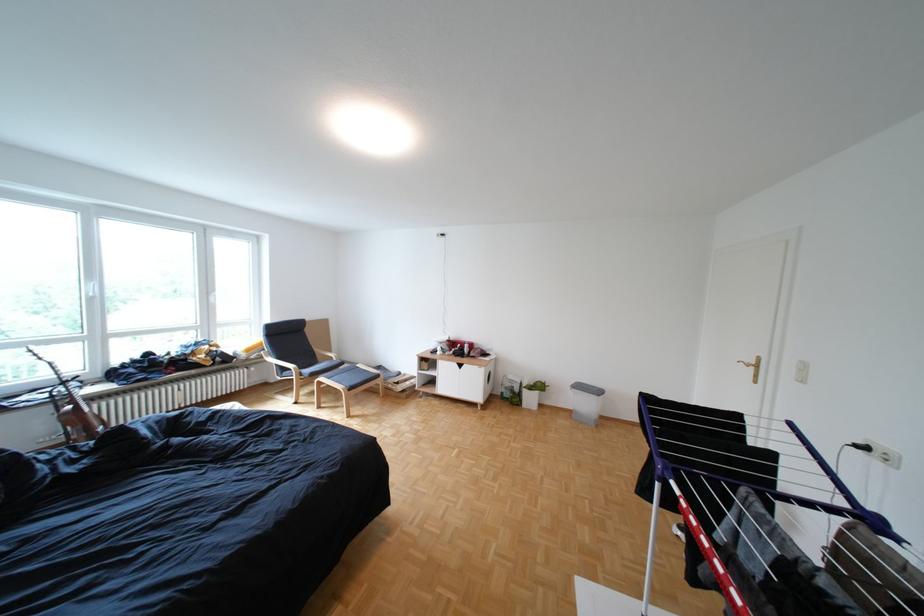
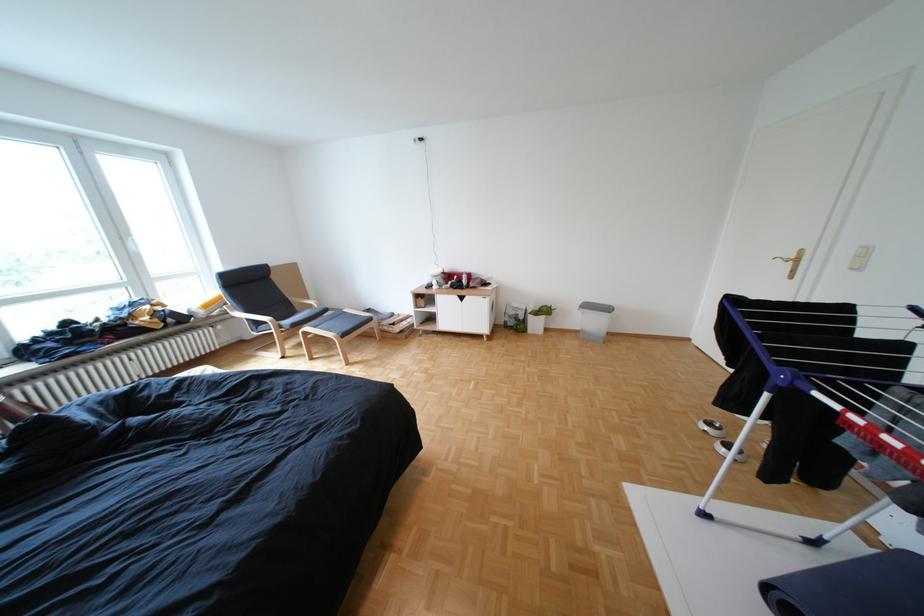
In the second image, find the point that corresponds to [441,349] in the first image.

(433, 284)